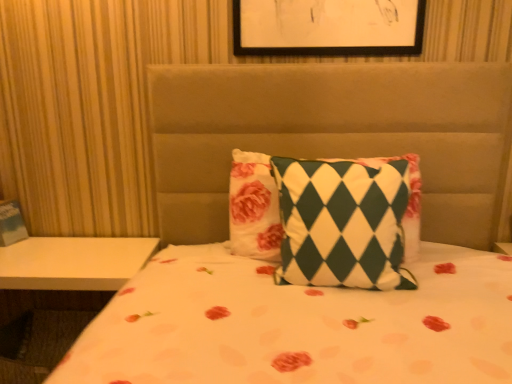
Describe the element at coordinates (254, 207) in the screenshot. I see `green and white checkered pillow at center` at that location.

Identify the location of green and white checkered pillow at center. This screenshot has width=512, height=384. (254, 207).

In order to face white glossy table at lower left, should I rotate leftwards or rightwards?

It's best to rotate left around 24.830 degrees.

Where is `white glossy table at lower left`? The width and height of the screenshot is (512, 384). white glossy table at lower left is located at coordinates (57, 296).

Describe the element at coordinates (57, 296) in the screenshot. This screenshot has height=384, width=512. I see `white glossy table at lower left` at that location.

At what (x,y) coordinates should I click in order to perform the action: click on green and white checkered pillow at center. Please return your answer as a coordinate pair (x, y). The image size is (512, 384). Looking at the image, I should click on (254, 207).

Which is more to the left, green and white checkered pillow at center or white glossy table at lower left?

white glossy table at lower left.

In the scene shown: Is green and white checkered pillow at center positioned before white glossy table at lower left?

Yes, it is in front of white glossy table at lower left.

Which is behind, point (408, 202) or point (124, 243)?

The point (124, 243) is farther.

From the image's perspective, is green and white checkered pillow at center positioned above or below white glossy table at lower left?

green and white checkered pillow at center is situated higher than white glossy table at lower left in the image.

From a real-world perspective, is green and white checkered pillow at center above or below white glossy table at lower left?

Clearly, from a real-world perspective, green and white checkered pillow at center is above white glossy table at lower left.

Considering the relative sizes of green and white checkered pillow at center and white glossy table at lower left in the image provided, is green and white checkered pillow at center thinner than white glossy table at lower left?

Yes.

Does green and white checkered pillow at center have a greater height compared to white glossy table at lower left?

In fact, green and white checkered pillow at center may be shorter than white glossy table at lower left.

Can you confirm if green and white checkered pillow at center is bigger than white glossy table at lower left?

No, green and white checkered pillow at center is not bigger than white glossy table at lower left.

Is white glossy table at lower left surrounded by green and white checkered pillow at center?

No, green and white checkered pillow at center does not contain white glossy table at lower left.

Are green and white checkered pillow at center and white glossy table at lower left beside each other?

green and white checkered pillow at center and white glossy table at lower left are clearly separated.

Is white glossy table at lower left at the back of green and white checkered pillow at center?

No.

Image resolution: width=512 pixels, height=384 pixels. Identify the location of table lying behind the green and white checkered pillow at center. (57, 296).

Is white glossy table at lower left to the right of green and white checkered pillow at center from the viewer's perspective?

No.

Which object is closer to the camera, white glossy table at lower left or green and white checkered pillow at center?

green and white checkered pillow at center is in front.

Does point (11, 284) appear closer or farther from the camera than point (370, 165)?

Point (11, 284) is farther from the camera than point (370, 165).

From the image's perspective, is white glossy table at lower left over green and white checkered pillow at center?

No, from the image's perspective, white glossy table at lower left is not over green and white checkered pillow at center.

From a real-world perspective, between white glossy table at lower left and green and white checkered pillow at center, who is vertically lower?

white glossy table at lower left, from a real-world perspective.

Considering the sizes of objects white glossy table at lower left and green and white checkered pillow at center in the image provided, who is wider, white glossy table at lower left or green and white checkered pillow at center?

Wider between the two is white glossy table at lower left.

Who is shorter, white glossy table at lower left or green and white checkered pillow at center?

With less height is green and white checkered pillow at center.

Who is bigger, white glossy table at lower left or green and white checkered pillow at center?

white glossy table at lower left.

Is green and white checkered pillow at center located within white glossy table at lower left?

That's incorrect, green and white checkered pillow at center is not inside white glossy table at lower left.

Is white glossy table at lower left next to green and white checkered pillow at center and touching it?

white glossy table at lower left and green and white checkered pillow at center are clearly separated.

Looking at this image, is white glossy table at lower left aimed at green and white checkered pillow at center?

No, white glossy table at lower left is not aimed at green and white checkered pillow at center.

Can you tell me how much white glossy table at lower left and green and white checkered pillow at center differ in facing direction?

The facing directions of white glossy table at lower left and green and white checkered pillow at center are 0.856 degrees apart.

Identify the location of table behind the green and white checkered pillow at center. (57, 296).

Identify the location of pillow positioned vertically above the white glossy table at lower left (from a real-world perspective). (254, 207).

You are a GUI agent. You are given a task and a screenshot of the screen. Output one action in this format:
    pyautogui.click(x=<x>, y=<y>)
    Task: Click on the pillow above the white glossy table at lower left (from the image's perspective)
    
    Given the screenshot: What is the action you would take?
    pyautogui.click(x=254, y=207)